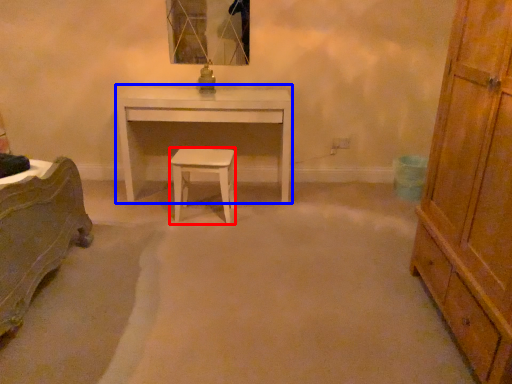
Question: Among these objects, which one is nearest to the camera, stool (highlighted by a red box) or desk (highlighted by a blue box)?

Choices:
 (A) stool
 (B) desk

Answer: (A)